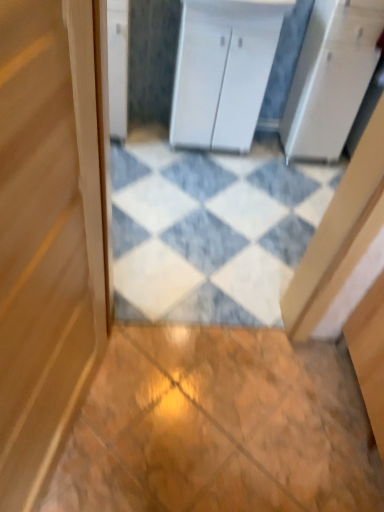
Question: Does white glossy cabinet at upper left, arranged as the first cabinetry when viewed from the left, appear on the right side of wooden door at center?

Choices:
 (A) yes
 (B) no

Answer: (B)

Question: Considering the relative sizes of white glossy cabinet at upper left, arranged as the first cabinetry when viewed from the left, and wooden door at center in the image provided, is white glossy cabinet at upper left, arranged as the first cabinetry when viewed from the left, wider than wooden door at center?

Choices:
 (A) yes
 (B) no

Answer: (A)

Question: Can you confirm if white glossy cabinet at upper left, the second cabinetry viewed from the right, is shorter than wooden door at center?

Choices:
 (A) no
 (B) yes

Answer: (B)

Question: From a real-world perspective, is white glossy cabinet at upper left, the second cabinetry viewed from the right, positioned under wooden door at center based on gravity?

Choices:
 (A) yes
 (B) no

Answer: (A)

Question: Is white glossy cabinet at upper left, the second cabinetry viewed from the right, at the left side of wooden door at center?

Choices:
 (A) yes
 (B) no

Answer: (A)

Question: From the image's perspective, is white glossy cabinet at upper left, the second cabinetry viewed from the right, positioned above or below white matte cabinet at center, the first cabinetry positioned from the right?

Choices:
 (A) below
 (B) above

Answer: (B)

Question: From a real-world perspective, is white glossy cabinet at upper left, arranged as the first cabinetry when viewed from the left, positioned above or below white matte cabinet at center, the second cabinetry viewed from the left?

Choices:
 (A) below
 (B) above

Answer: (A)

Question: In the image, is white glossy cabinet at upper left, the second cabinetry viewed from the right, on the left side or the right side of white matte cabinet at center, the second cabinetry viewed from the left?

Choices:
 (A) right
 (B) left

Answer: (B)

Question: Considering the positions of white glossy cabinet at upper left, the second cabinetry viewed from the right, and white matte cabinet at center, the second cabinetry viewed from the left, in the image, is white glossy cabinet at upper left, the second cabinetry viewed from the right, taller or shorter than white matte cabinet at center, the second cabinetry viewed from the left,?

Choices:
 (A) short
 (B) tall

Answer: (A)

Question: In terms of height, does white glossy cabinet at upper left, the second cabinetry viewed from the right, look taller or shorter compared to white marble tile at center, arranged as the second tile when ordered from the bottom?

Choices:
 (A) short
 (B) tall

Answer: (B)

Question: Visually, is white glossy cabinet at upper left, the second cabinetry viewed from the right, positioned to the left or to the right of white marble tile at center, marked as the 1th tile in a back-to-front arrangement?

Choices:
 (A) left
 (B) right

Answer: (A)

Question: Is white glossy cabinet at upper left, the second cabinetry viewed from the right, situated inside white marble tile at center, which appears as the 2th tile when viewed from the front, or outside?

Choices:
 (A) outside
 (B) inside

Answer: (A)

Question: From a real-world perspective, relative to white marble tile at center, which appears as the 2th tile when viewed from the front, is white glossy cabinet at upper left, arranged as the first cabinetry when viewed from the left, vertically above or below?

Choices:
 (A) below
 (B) above

Answer: (B)

Question: Based on their sizes in the image, would you say white glossy counter top at upper center is bigger or smaller than white marble tile at center, arranged as the second tile when ordered from the bottom?

Choices:
 (A) big
 (B) small

Answer: (B)

Question: From a real-world perspective, is white glossy counter top at upper center physically located above or below white marble tile at center, arranged as the second tile when ordered from the bottom?

Choices:
 (A) below
 (B) above

Answer: (B)